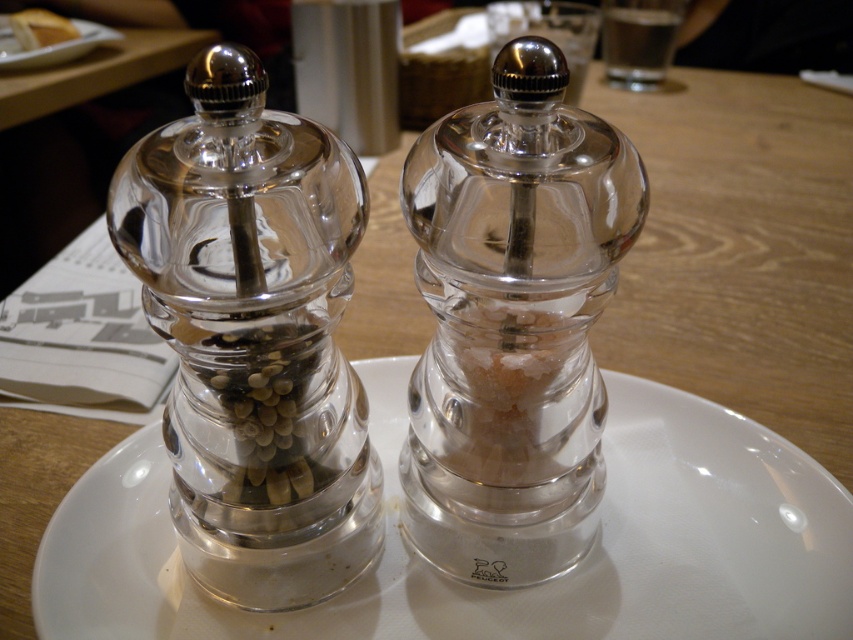
Question: Is the position of clear glass pepper grinder at left less distant than that of matte white bread at upper left?

Choices:
 (A) no
 (B) yes

Answer: (B)

Question: Which point appears closest to the camera in this image?

Choices:
 (A) (47, 16)
 (B) (199, 100)

Answer: (B)

Question: Which point is farther to the camera?

Choices:
 (A) transparent glass plate at center
 (B) transparent glass salt shaker at center
 (C) white glossy plate at upper left
 (D) clear glass pepper grinder at left

Answer: (C)

Question: Is transparent glass plate at center bigger than transparent glass salt shaker at center?

Choices:
 (A) no
 (B) yes

Answer: (B)

Question: Which point appears farthest from the camera in this image?

Choices:
 (A) (193, 193)
 (B) (47, 13)
 (C) (38, 61)

Answer: (B)

Question: Is clear glass pepper grinder at left positioned behind matte white bread at upper left?

Choices:
 (A) yes
 (B) no

Answer: (B)